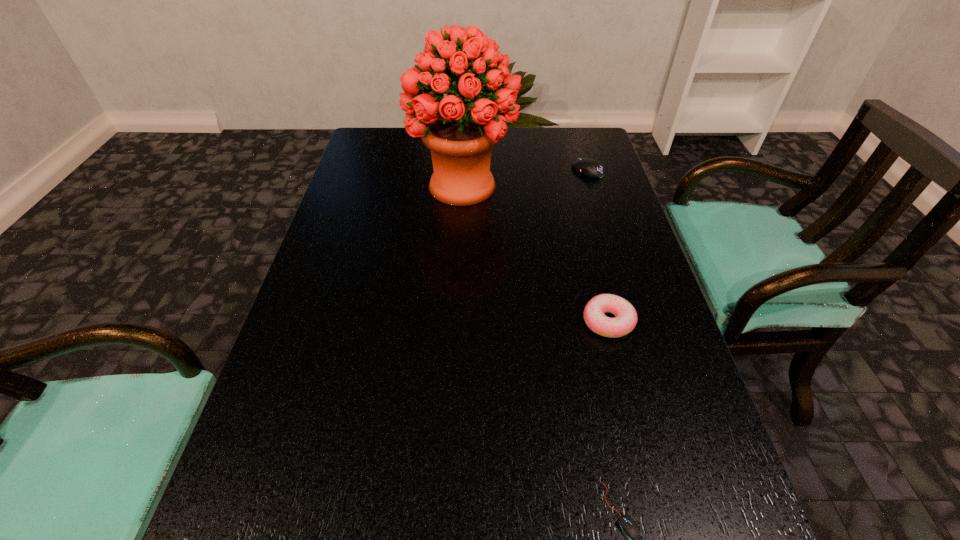
Where is `blank region between the third shortest object and the third tallest object`? The height and width of the screenshot is (540, 960). blank region between the third shortest object and the third tallest object is located at coordinates (598, 246).

The width and height of the screenshot is (960, 540). I want to click on vacant region between the taller mouse and the leftmost object, so click(525, 178).

Find the location of a particular element. object that can be found as the closest to the third tallest object is located at coordinates (460, 138).

Point out which object is positioned as the nearest to the taller mouse. Please provide its 2D coordinates. Your answer should be formatted as a tuple, i.e. [(x, y)], where the tuple contains the x and y coordinates of a point satisfying the conditions above.

[(460, 138)]